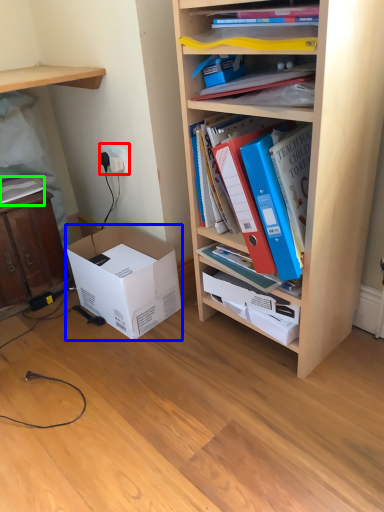
Question: Based on their relative distances, which object is nearer to electric outlet (highlighted by a red box)? Choose from box (highlighted by a blue box) and book (highlighted by a green box).

Choices:
 (A) box
 (B) book

Answer: (B)